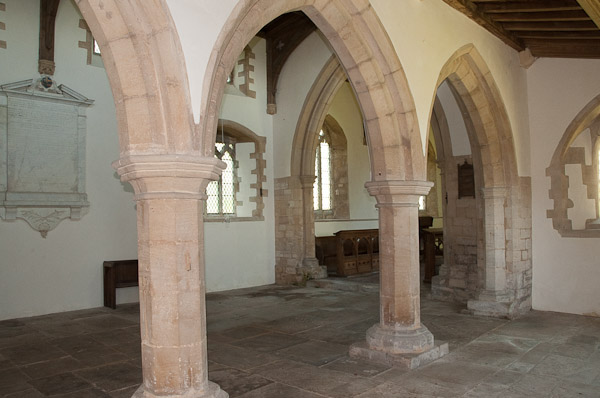
Identify the location of chair. (124, 273).